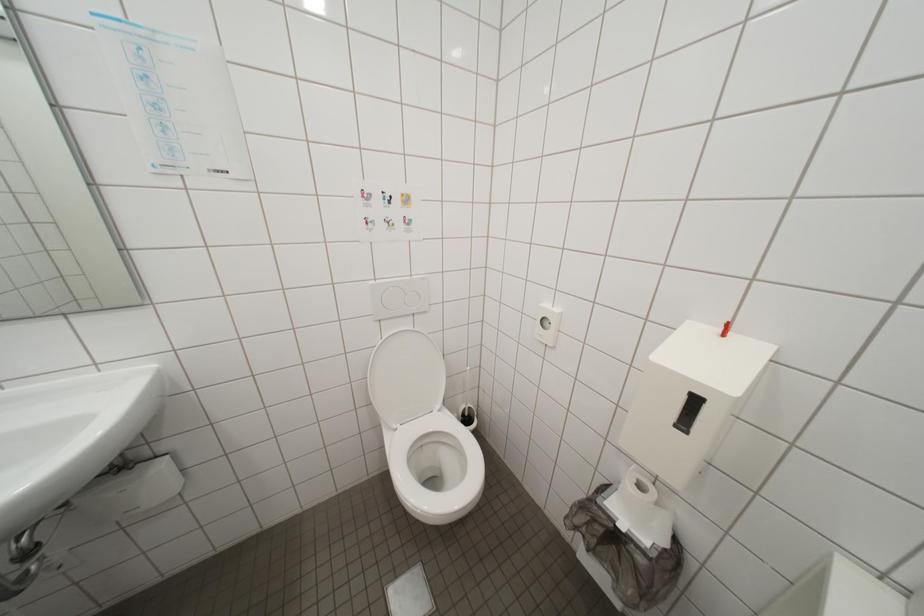
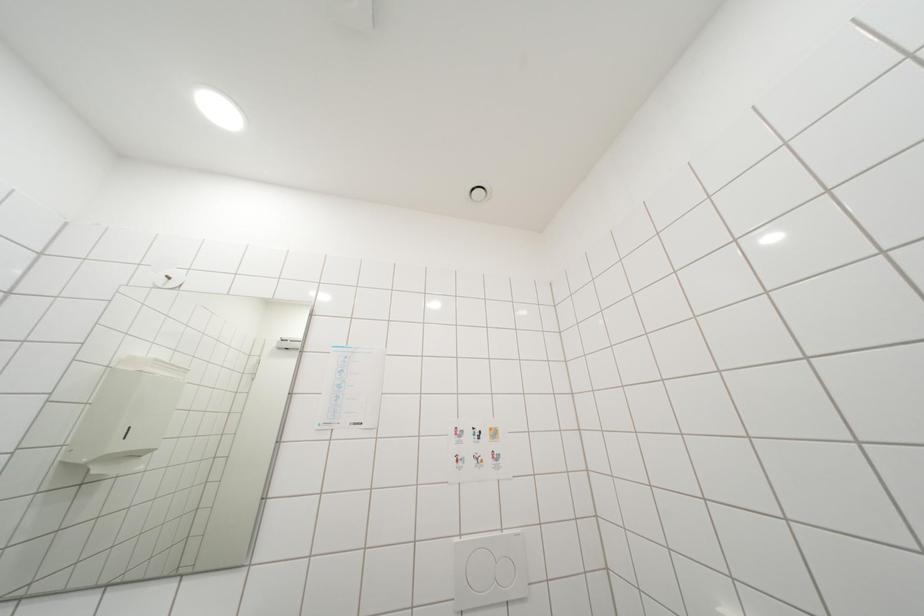
How did the camera likely rotate?

The camera's rotation is toward left-up.